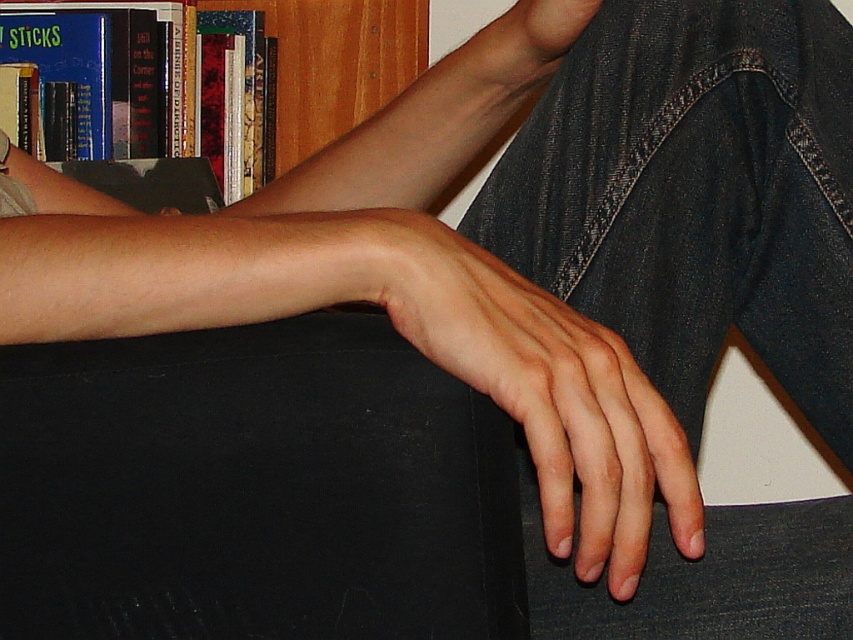
Question: Does dark blue denim jeans at lower right have a lesser width compared to smooth skin hand at center?

Choices:
 (A) yes
 (B) no

Answer: (B)

Question: Which of the following is the farthest from the observer?

Choices:
 (A) (604, 29)
 (B) (614, 592)

Answer: (A)

Question: Is dark blue denim jeans at lower right wider than smooth skin hand at center?

Choices:
 (A) no
 (B) yes

Answer: (B)

Question: Which of these objects is positioned closest to the smooth skin hand at center?

Choices:
 (A) dark blue denim jeans at lower right
 (B) wooden bookcase at upper left

Answer: (A)

Question: Is the position of smooth skin hand at center more distant than that of wooden bookcase at upper left?

Choices:
 (A) no
 (B) yes

Answer: (A)

Question: Among these objects, which one is nearest to the camera?

Choices:
 (A) wooden bookcase at upper left
 (B) smooth skin hand at center
 (C) dark blue denim jeans at lower right

Answer: (B)